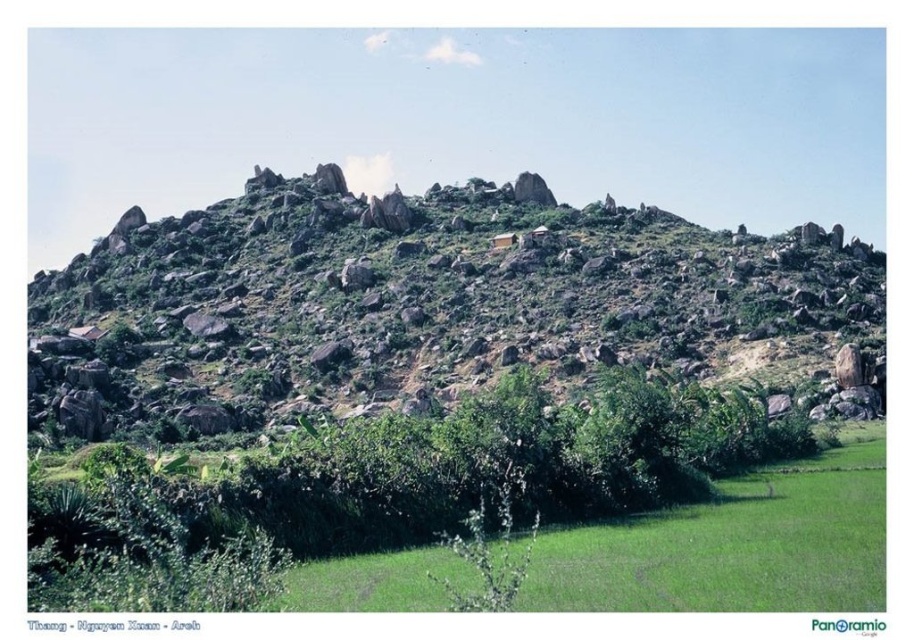
Is point (354, 301) behind point (822, 460)?

Yes.

Is point (272, 266) more distant than point (368, 568)?

Yes, point (272, 266) is behind point (368, 568).

You are a GUI agent. You are given a task and a screenshot of the screen. Output one action in this format:
    pyautogui.click(x=<x>, y=<y>)
    Task: Click on the rough stone mountain at upper center
    This screenshot has width=914, height=640.
    Given the screenshot: What is the action you would take?
    pyautogui.click(x=413, y=301)